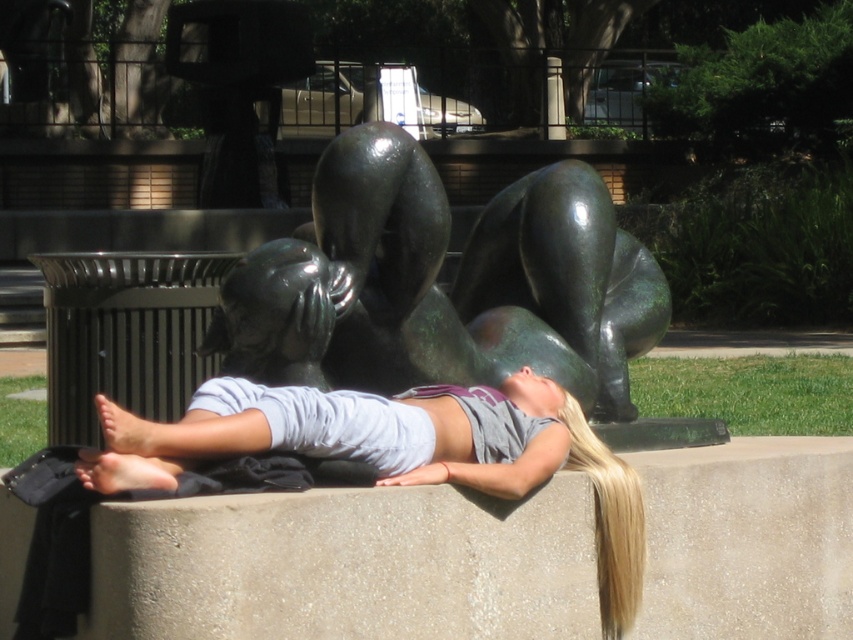
Question: Among these objects, which one is nearest to the camera?

Choices:
 (A) gray cotton shirt at center
 (B) green patina sculpture at center

Answer: (A)

Question: Which of the following is the closest to the observer?

Choices:
 (A) green patina sculpture at center
 (B) gray cotton shirt at center

Answer: (B)

Question: Can you confirm if green patina sculpture at center is positioned to the right of gray cotton shirt at center?

Choices:
 (A) yes
 (B) no

Answer: (A)

Question: Is green patina sculpture at center further to camera compared to gray cotton shirt at center?

Choices:
 (A) no
 (B) yes

Answer: (B)

Question: Is green patina sculpture at center positioned before gray cotton shirt at center?

Choices:
 (A) no
 (B) yes

Answer: (A)